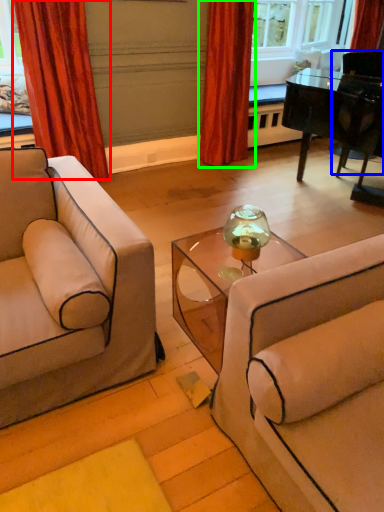
Question: Which is nearer to the curtain (highlighted by a red box)? armchair (highlighted by a blue box) or curtain (highlighted by a green box).

Choices:
 (A) armchair
 (B) curtain

Answer: (B)